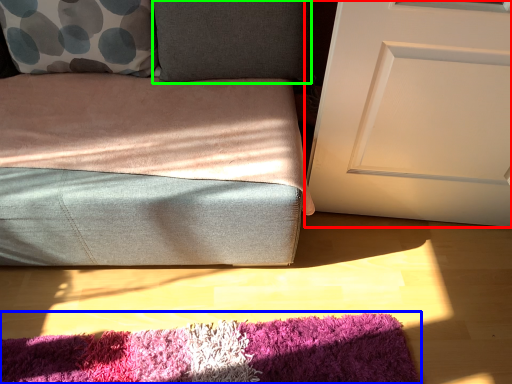
Question: Estimate the real-world distances between objects in this image. Which object is farther from door (highlighted by a red box), mat (highlighted by a blue box) or pillow (highlighted by a green box)?

Choices:
 (A) mat
 (B) pillow

Answer: (A)